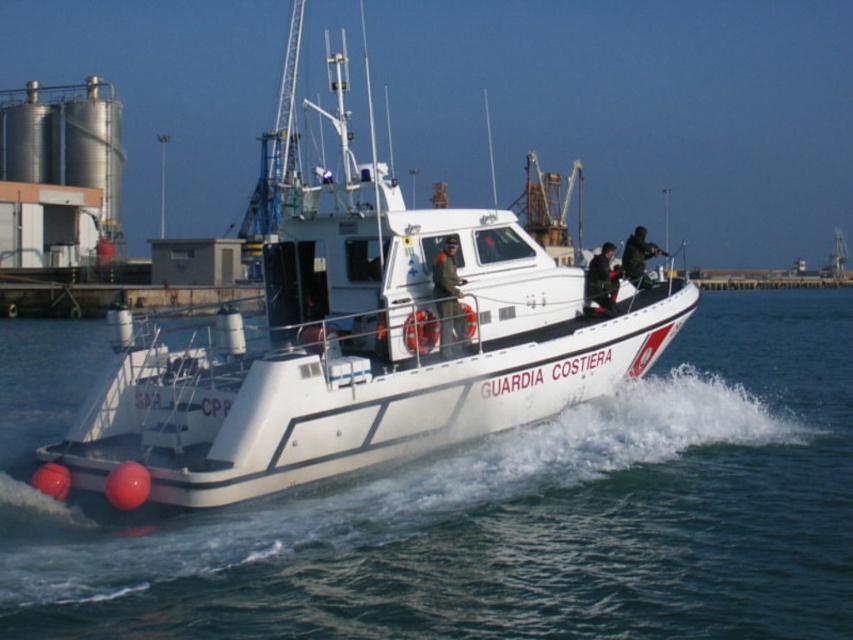
Question: Which of the following is the farthest from the observer?

Choices:
 (A) (335, 589)
 (B) (432, 401)

Answer: (B)

Question: Can you confirm if white water at center is wider than white matte boat at center?

Choices:
 (A) yes
 (B) no

Answer: (A)

Question: Is white water at center to the right of white matte boat at center from the viewer's perspective?

Choices:
 (A) yes
 (B) no

Answer: (A)

Question: Which object is farther from the camera taking this photo?

Choices:
 (A) white water at center
 (B) white matte boat at center

Answer: (B)

Question: Does white water at center have a larger size compared to white matte boat at center?

Choices:
 (A) no
 (B) yes

Answer: (A)